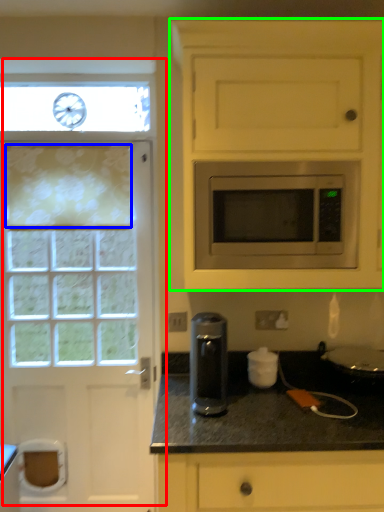
Question: Estimate the real-world distances between objects in this image. Which object is closer to door (highlighted by a red box), curtain (highlighted by a blue box) or cabinetry (highlighted by a green box)?

Choices:
 (A) curtain
 (B) cabinetry

Answer: (A)